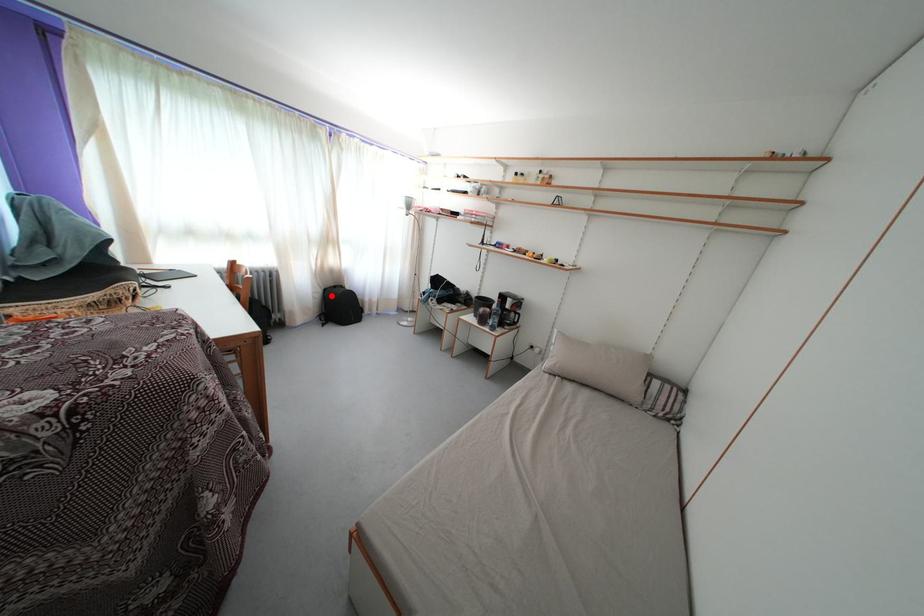
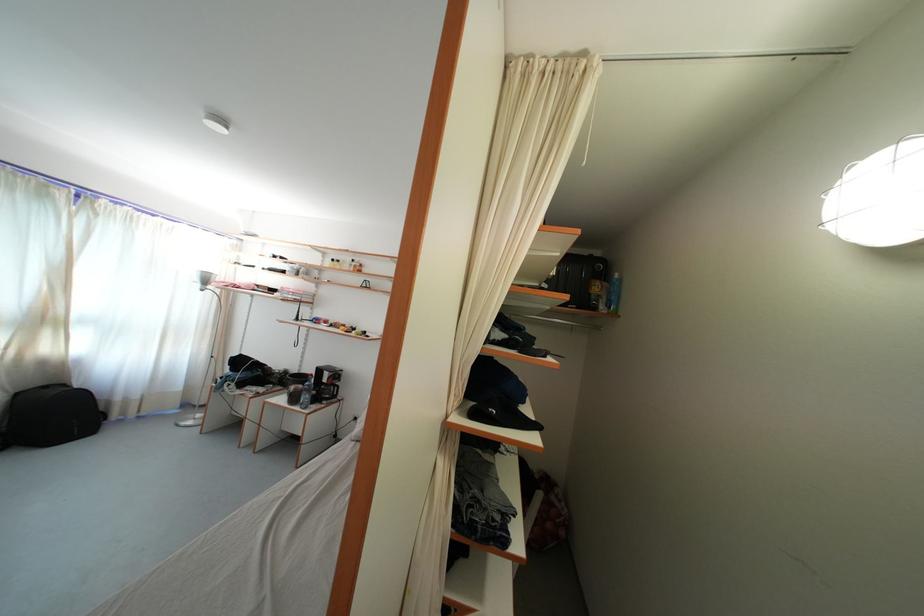
The point at the highlighted location is marked in the first image. Where is the corresponding point in the second image?

(23, 400)